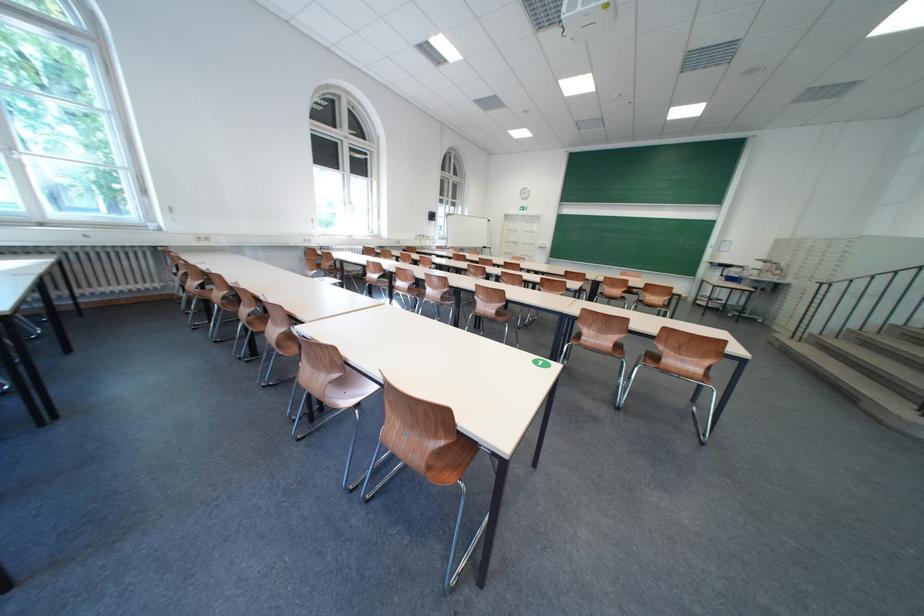
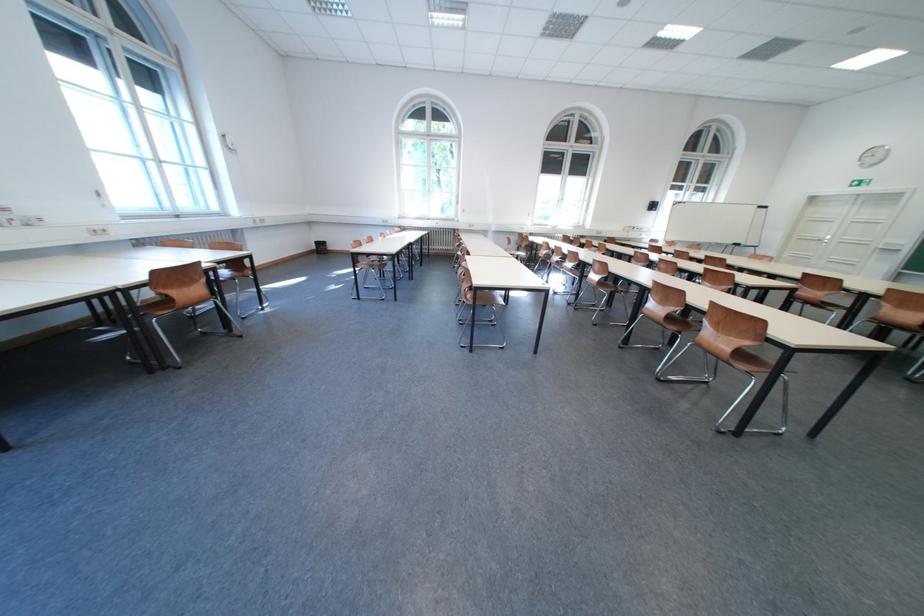
Where in the second image is the point corresponding to the point at 714,373 from the first image?

(744, 352)